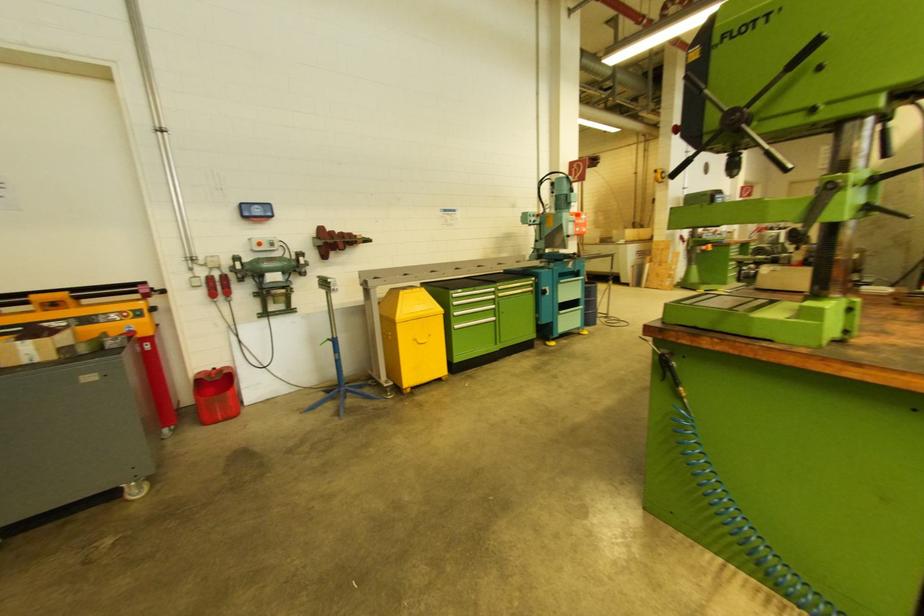
This screenshot has height=616, width=924. In order to click on yellow bin handle in this screenshot , I will do `click(424, 337)`.